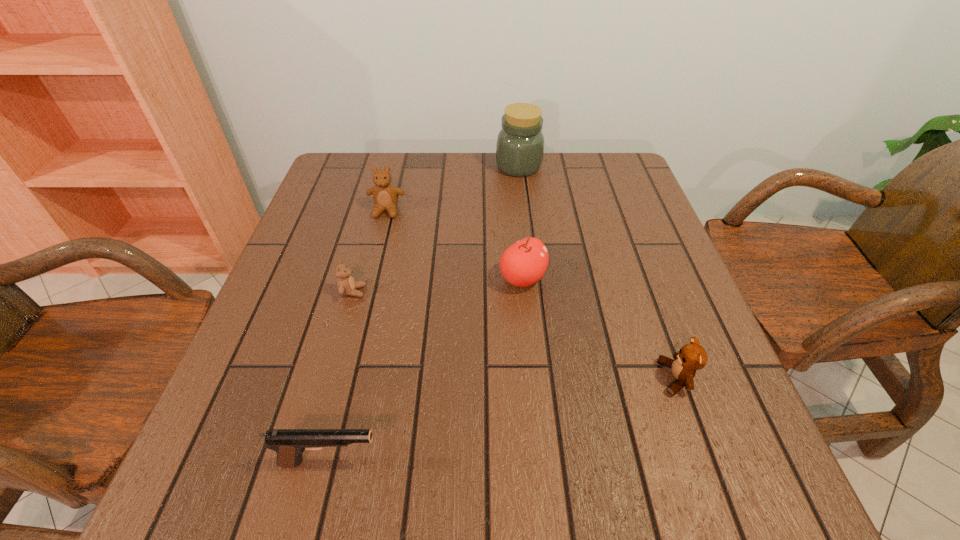
The width and height of the screenshot is (960, 540). Find the location of `object located at the right edge`. object located at the right edge is located at coordinates (691, 357).

The height and width of the screenshot is (540, 960). Find the location of `object that is at the near left corner`. object that is at the near left corner is located at coordinates (289, 444).

Identify the location of vacant space at the far edge. (464, 152).

Where is `vacant space at the left edge of the desktop`? vacant space at the left edge of the desktop is located at coordinates (292, 363).

This screenshot has height=540, width=960. Find the location of `blank space at the right edge of the desktop`. blank space at the right edge of the desktop is located at coordinates (708, 412).

Find the location of a particular element. Image resolution: width=960 pixels, height=540 pixels. vacant area at the far right corner is located at coordinates (591, 178).

Identify the location of vacant point located between the nearest object and the apple. This screenshot has width=960, height=540. (426, 370).

The width and height of the screenshot is (960, 540). What are the coordinates of `vacant region between the pistol and the second farthest teddy bear` in the screenshot? It's located at (342, 376).

Locate an element on the screen. This screenshot has width=960, height=540. free point between the tallest object and the rightmost teddy bear is located at coordinates (597, 272).

At what (x,y) coordinates should I click in order to perform the action: click on empty space that is in between the tallest object and the second farthest teddy bear. Please return your answer as a coordinate pair (x, y). Image resolution: width=960 pixels, height=540 pixels. Looking at the image, I should click on pyautogui.click(x=436, y=229).